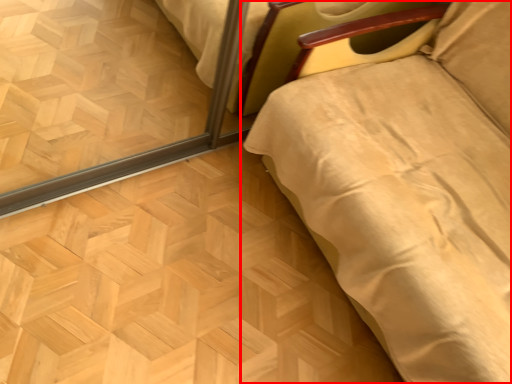
Question: Where is furniture (annotated by the red box) located in relation to plywood in the image?

Choices:
 (A) right
 (B) left

Answer: (A)